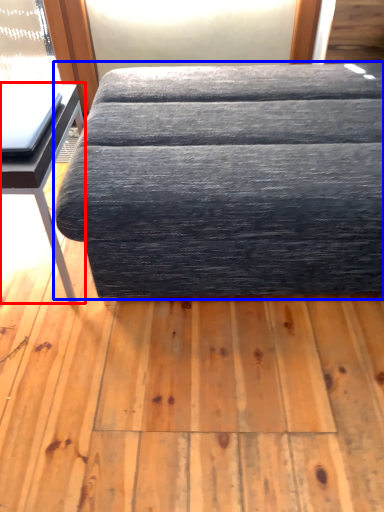
Question: Which object is further to the camera taking this photo, table (highlighted by a red box) or studio couch (highlighted by a blue box)?

Choices:
 (A) table
 (B) studio couch

Answer: (A)